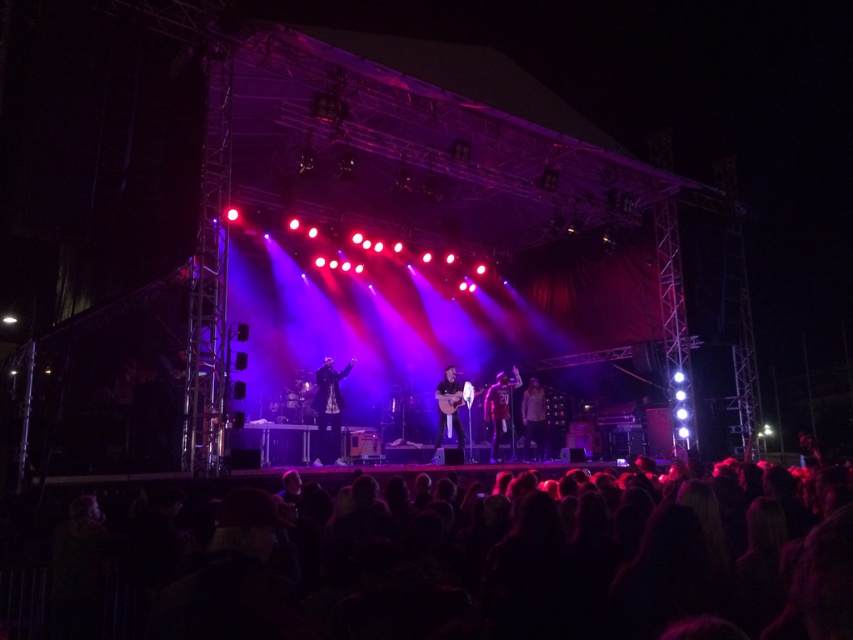
You are a photographer at the concert and want to capture a photo that includes both the black hair at lower center and the shiny metallic jacket at center. Given that your camera has a maximum focus range of 30 feet, will you be able to include both in the same frame without moving closer?

The black hair at lower center and shiny metallic jacket at center are 30.10 feet apart. Since the distance between them exceeds the camera maximum focus range of 30 feet, you won

You are a photographer at the concert and want to capture a closeup of the musician wearing the matte red shirt at center and the shiny metallic jacket at center. Since your camera has a limited focus range, you need to know which clothing item is wider to ensure proper framing. Which one is wider?

The matte red shirt at center is wider than the shiny metallic jacket at center according to the description.